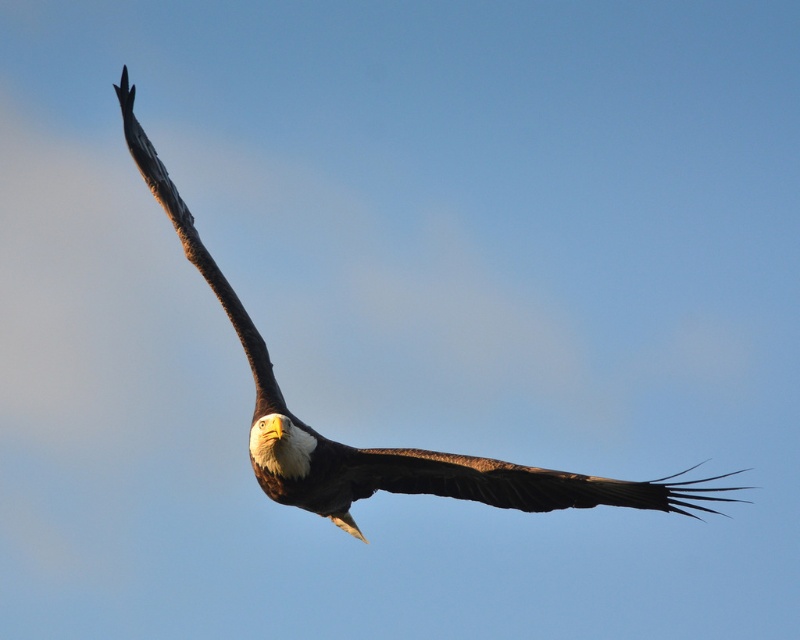
You are a photographer trying to capture the bald eagle in flight. You notice the brown feathered eagle at upper left and the brown feathered wing at upper center in your viewfinder. Which object should you focus on if you want to capture the eagle closest to the top of the frame?

The brown feathered eagle at upper left is above the brown feathered wing at upper center, so focusing on the brown feathered eagle at upper left will capture the eagle closest to the top of the frame.

You are a wildlife photographer trying to capture the bald eagle in flight. You notice two wings in the image, the brown feathered wing at upper center and the brown textured wing at upper left. Which wing should you focus on to ensure your camera captures the wider wing span for a dramatic effect?

The brown feathered wing at upper center has a larger width than the brown textured wing at upper left, so focusing on the brown feathered wing at upper center will capture the wider wing span for a dramatic effect.

You are a photographer observing a bald eagle in flight. You notice the brown feathered eagle at upper left and the brown feathered wing at upper center. Which object is positioned further to the left?

The brown feathered eagle at upper left is positioned further to the left than the brown feathered wing at upper center.